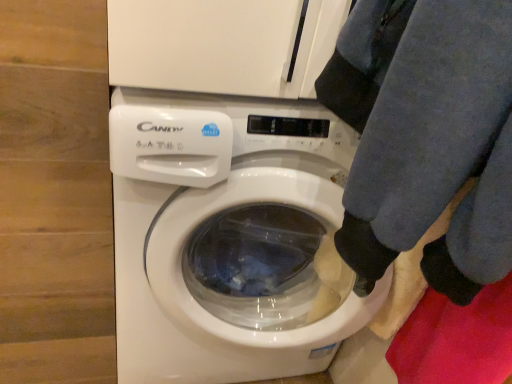
What do you see at coordinates (229, 238) in the screenshot?
I see `white glossy washing machine at center` at bounding box center [229, 238].

At what (x,y) coordinates should I click in order to perform the action: click on white glossy washing machine at center. Please return your answer as a coordinate pair (x, y). The width and height of the screenshot is (512, 384). Looking at the image, I should click on (229, 238).

In order to face white glossy washing machine at center, should I rotate leftwards or rightwards?

Turn left by 1.415 degrees to look at white glossy washing machine at center.

In order to face blue fleece pants at lower right, should I rotate leftwards or rightwards?

You should look right and rotate roughly 21.329 degrees.

Image resolution: width=512 pixels, height=384 pixels. What do you see at coordinates (426, 136) in the screenshot?
I see `blue fleece pants at lower right` at bounding box center [426, 136].

The width and height of the screenshot is (512, 384). What are the coordinates of `blue fleece pants at lower right` in the screenshot? It's located at (426, 136).

Locate an element on the screen. This screenshot has height=384, width=512. white glossy washing machine at center is located at coordinates [229, 238].

Considering the positions of objects white glossy washing machine at center and blue fleece pants at lower right in the image provided, who is more to the right, white glossy washing machine at center or blue fleece pants at lower right?

From the viewer's perspective, blue fleece pants at lower right appears more on the right side.

Is white glossy washing machine at center behind blue fleece pants at lower right?

Yes, white glossy washing machine at center is further from the viewer.

Considering the points (328, 346) and (410, 28), which point is in front, point (328, 346) or point (410, 28)?

Point (410, 28)

From the image's perspective, does white glossy washing machine at center appear lower than blue fleece pants at lower right?

Yes.

From a real-world perspective, which is physically above, white glossy washing machine at center or blue fleece pants at lower right?

blue fleece pants at lower right.

Considering the relative sizes of white glossy washing machine at center and blue fleece pants at lower right in the image provided, is white glossy washing machine at center wider than blue fleece pants at lower right?

Yes, white glossy washing machine at center is wider than blue fleece pants at lower right.

Is white glossy washing machine at center taller than blue fleece pants at lower right?

Yes.

Which of these two, white glossy washing machine at center or blue fleece pants at lower right, is bigger?

white glossy washing machine at center.

Is blue fleece pants at lower right inside white glossy washing machine at center?

No, blue fleece pants at lower right is located outside of white glossy washing machine at center.

Would you consider white glossy washing machine at center to be distant from blue fleece pants at lower right?

No.

Is white glossy washing machine at center oriented away from blue fleece pants at lower right?

No, white glossy washing machine at center's orientation is not away from blue fleece pants at lower right.

What's the angular difference between white glossy washing machine at center and blue fleece pants at lower right's facing directions?

The facing directions of white glossy washing machine at center and blue fleece pants at lower right are 90.9 degrees apart.

How distant is white glossy washing machine at center from blue fleece pants at lower right?

They are 14.38 inches apart.

The height and width of the screenshot is (384, 512). In order to click on clothing above the white glossy washing machine at center (from the image's perspective) in this screenshot , I will do `click(426, 136)`.

Which is more to the right, blue fleece pants at lower right or white glossy washing machine at center?

blue fleece pants at lower right.

Is the depth of blue fleece pants at lower right less than that of white glossy washing machine at center?

Yes, it is.

Does point (334, 85) come farther from viewer compared to point (128, 241)?

No, it is in front of (128, 241).

From the image's perspective, would you say blue fleece pants at lower right is shown under white glossy washing machine at center?

Actually, blue fleece pants at lower right appears above white glossy washing machine at center in the image.

From a real-world perspective, relative to white glossy washing machine at center, is blue fleece pants at lower right vertically above or below?

From a real-world perspective, blue fleece pants at lower right is physically above white glossy washing machine at center.

Which object is wider, blue fleece pants at lower right or white glossy washing machine at center?

Wider between the two is white glossy washing machine at center.

Considering the relative sizes of blue fleece pants at lower right and white glossy washing machine at center in the image provided, is blue fleece pants at lower right shorter than white glossy washing machine at center?

Yes.

Consider the image. Can you confirm if blue fleece pants at lower right is bigger than white glossy washing machine at center?

No, blue fleece pants at lower right is not bigger than white glossy washing machine at center.

Do you think blue fleece pants at lower right is within white glossy washing machine at center, or outside of it?

blue fleece pants at lower right is not inside white glossy washing machine at center, it's outside.

Are blue fleece pants at lower right and white glossy washing machine at center located far from each other?

No, blue fleece pants at lower right is not far away from white glossy washing machine at center.

Could you tell me if blue fleece pants at lower right is turned towards white glossy washing machine at center?

No, blue fleece pants at lower right does not turn towards white glossy washing machine at center.

Can you tell me how much blue fleece pants at lower right and white glossy washing machine at center differ in facing direction?

There is a 90.9-degree angle between the facing directions of blue fleece pants at lower right and white glossy washing machine at center.

Identify the location of clothing on the right of the white glossy washing machine at center. (426, 136).

You are a GUI agent. You are given a task and a screenshot of the screen. Output one action in this format:
    pyautogui.click(x=<x>, y=<y>)
    Task: Click on the clothing above the white glossy washing machine at center (from a real-world perspective)
    The image size is (512, 384).
    Given the screenshot: What is the action you would take?
    pyautogui.click(x=426, y=136)

You are a GUI agent. You are given a task and a screenshot of the screen. Output one action in this format:
    pyautogui.click(x=<x>, y=<y>)
    Task: Click on the clothing that appears in front of the white glossy washing machine at center
    The image size is (512, 384).
    Given the screenshot: What is the action you would take?
    pyautogui.click(x=426, y=136)